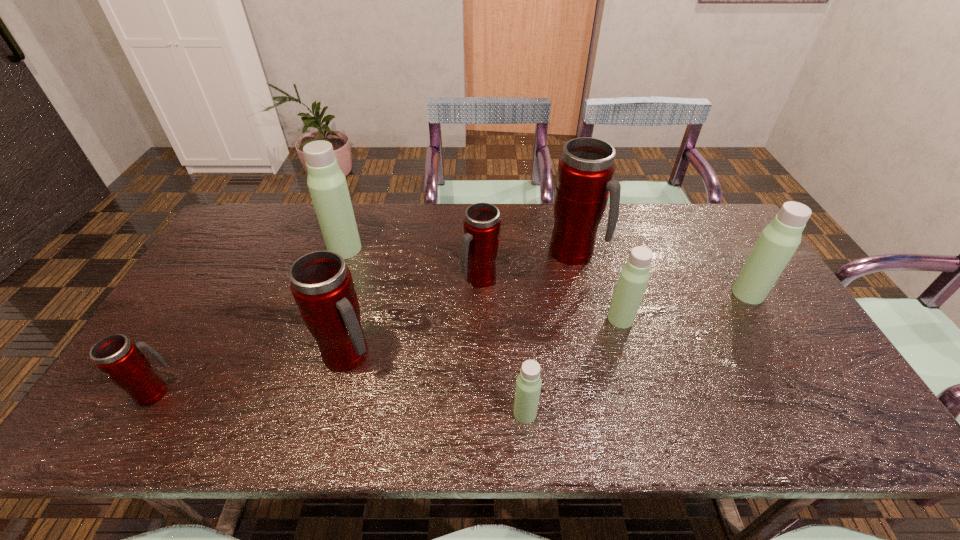
The image size is (960, 540). Find the location of `vacant area located on the side with the handle of the leftmost thermos bottle`. vacant area located on the side with the handle of the leftmost thermos bottle is located at coordinates (196, 322).

I want to click on free spot located on the side with the handle of the leftmost thermos bottle, so click(229, 266).

Find the location of a particular element. vacant space located on the side with the handle of the leftmost thermos bottle is located at coordinates (181, 346).

At what (x,y) coordinates should I click in order to perform the action: click on vacant space located 0.090m on the left of the fourth thermos bottle from right to left. Please return your answer as a coordinate pair (x, y). Image resolution: width=960 pixels, height=540 pixels. Looking at the image, I should click on (474, 413).

This screenshot has width=960, height=540. I want to click on object at the left edge, so click(119, 358).

Locate an element on the screen. Image resolution: width=960 pixels, height=540 pixels. object that is at the right edge is located at coordinates tap(778, 241).

The image size is (960, 540). In order to click on object at the near left corner in this screenshot , I will do `click(119, 358)`.

Identify the location of vacant space at the far edge of the desktop. The width and height of the screenshot is (960, 540). (367, 222).

In the image, there is a desktop. What are the coordinates of `vacant space at the near edge` in the screenshot? It's located at (765, 427).

In the image, there is a desktop. Where is `vacant space at the left edge`? The image size is (960, 540). vacant space at the left edge is located at coordinates (230, 287).